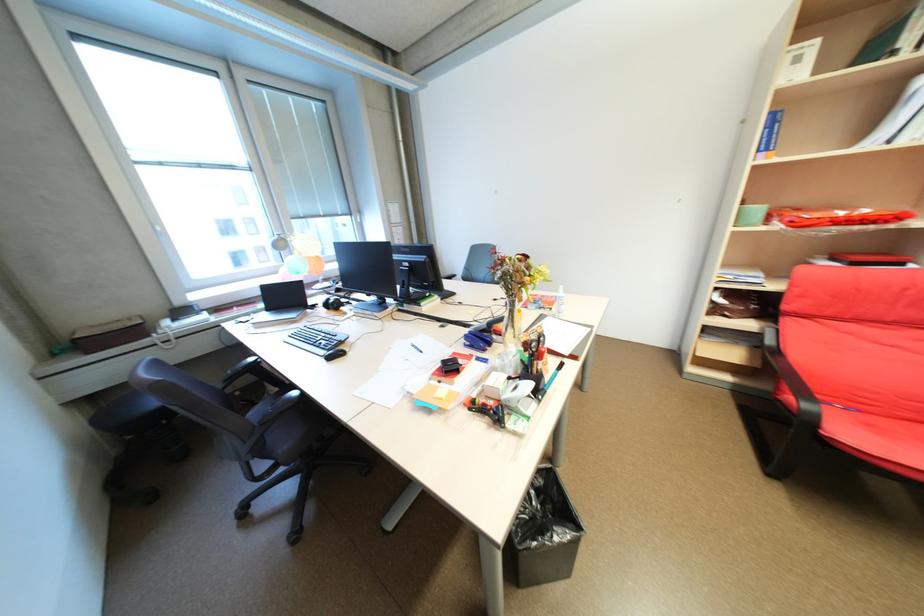
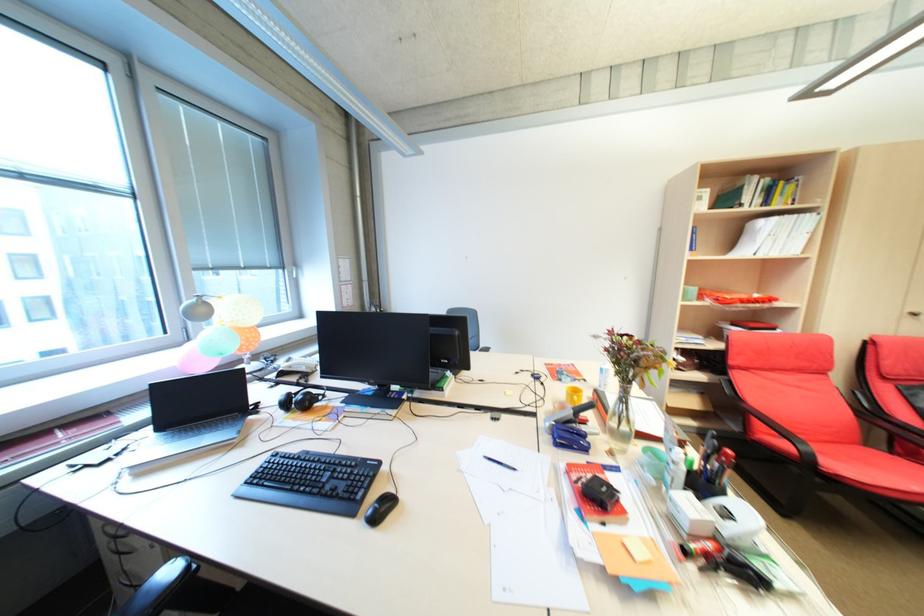
Question: I am providing you with two images of the same scene from different viewpoints. Please identify which objects are invisible in image2.

Choices:
 (A) cabinet door handle
 (B) red chair sitting surface
 (C) black headphones
 (D) none of these

Answer: (D)